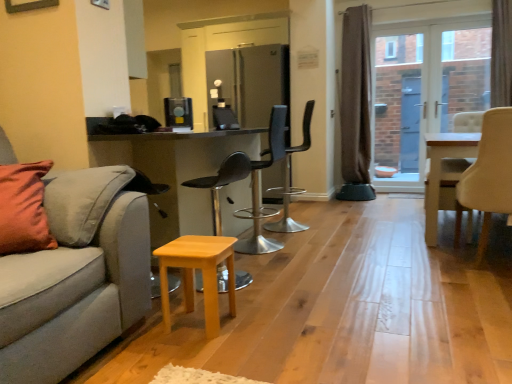
Question: Can you confirm if wooden stool at center, the 4th chair in the right-to-left sequence, is taller than white wooden table at center?

Choices:
 (A) yes
 (B) no

Answer: (A)

Question: Is wooden stool at center, the 4th chair in the right-to-left sequence, behind white wooden table at center?

Choices:
 (A) no
 (B) yes

Answer: (A)

Question: Is wooden stool at center, the 4th chair in the right-to-left sequence, to the left of white wooden table at center from the viewer's perspective?

Choices:
 (A) yes
 (B) no

Answer: (A)

Question: Is the depth of wooden stool at center, the 4th chair in the right-to-left sequence, less than that of white wooden table at center?

Choices:
 (A) no
 (B) yes

Answer: (B)

Question: Is wooden stool at center, the 4th chair in the right-to-left sequence, bigger than white wooden table at center?

Choices:
 (A) yes
 (B) no

Answer: (B)

Question: From the image's perspective, is satin silver refrigerator at center, marked as the first appliance in a back-to-front arrangement, above or below white wooden table at center?

Choices:
 (A) above
 (B) below

Answer: (A)

Question: From their relative heights in the image, would you say satin silver refrigerator at center, which appears as the second appliance when viewed from the front, is taller or shorter than white wooden table at center?

Choices:
 (A) tall
 (B) short

Answer: (A)

Question: In terms of size, does satin silver refrigerator at center, which appears as the second appliance when viewed from the front, appear bigger or smaller than white wooden table at center?

Choices:
 (A) big
 (B) small

Answer: (A)

Question: Is satin silver refrigerator at center, placed as the second appliance when sorted from left to right, in front of or behind white wooden table at center in the image?

Choices:
 (A) front
 (B) behind

Answer: (B)

Question: In terms of height, does light wood stool at lower center look taller or shorter compared to brown fabric curtain at upper right, the second curtain positioned from the back?

Choices:
 (A) tall
 (B) short

Answer: (B)

Question: Is light wood stool at lower center bigger or smaller than brown fabric curtain at upper right, the second curtain positioned from the back?

Choices:
 (A) small
 (B) big

Answer: (A)

Question: In terms of width, does light wood stool at lower center look wider or thinner when compared to brown fabric curtain at upper right, the first curtain from the right?

Choices:
 (A) thin
 (B) wide

Answer: (A)

Question: Is light wood stool at lower center in front of or behind brown fabric curtain at upper right, the second curtain positioned from the back, in the image?

Choices:
 (A) front
 (B) behind

Answer: (A)

Question: Relative to black plastic chair at center, the 3th chair from the right, is clear glass door at center in front or behind?

Choices:
 (A) behind
 (B) front

Answer: (A)

Question: From the image's perspective, is clear glass door at center positioned above or below black plastic chair at center, the 3th chair from the right?

Choices:
 (A) above
 (B) below

Answer: (A)